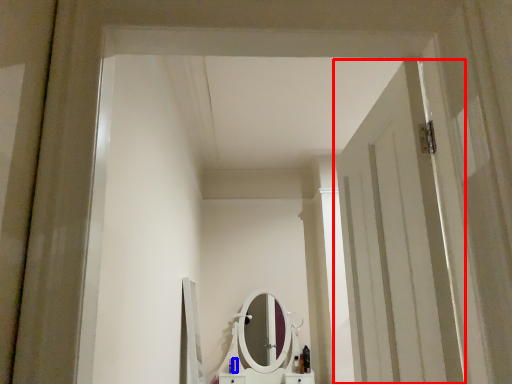
Question: Which object is closer to the camera taking this photo, door (highlighted by a red box) or toiletry (highlighted by a blue box)?

Choices:
 (A) door
 (B) toiletry

Answer: (A)